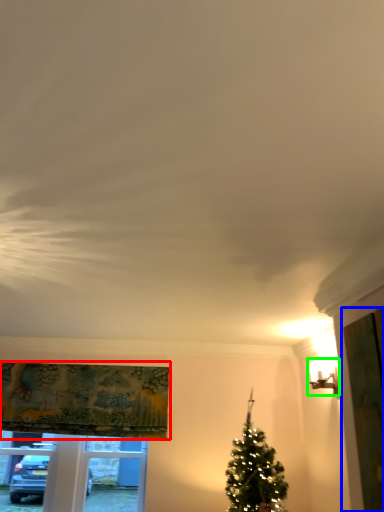
Question: Which is nearer to the curtain (highlighted by a red box)? screen door (highlighted by a blue box) or light fixture (highlighted by a green box).

Choices:
 (A) screen door
 (B) light fixture

Answer: (B)